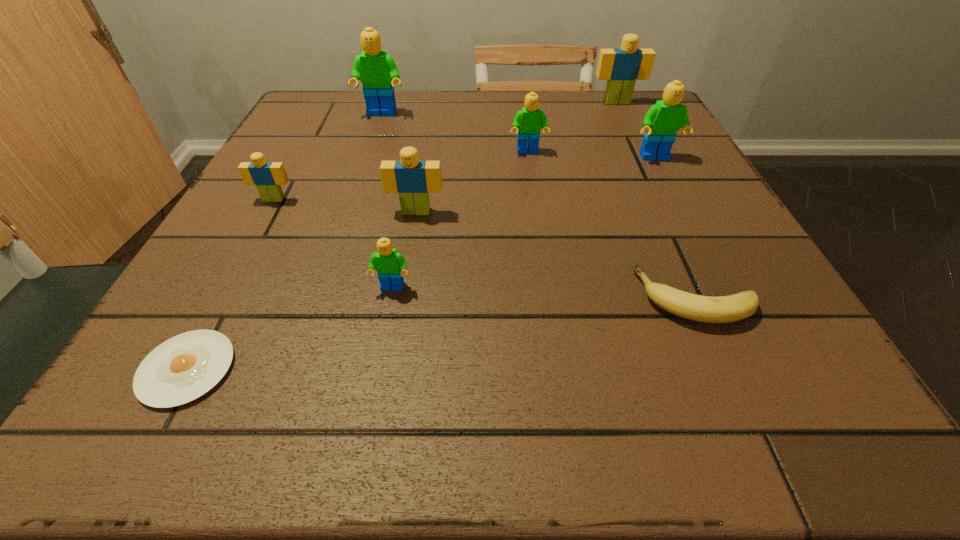
Where is `blank area located on the face of the nearest beige Lego`? blank area located on the face of the nearest beige Lego is located at coordinates (409, 257).

Where is `free region located on the face of the fifth Lego from left to right`? free region located on the face of the fifth Lego from left to right is located at coordinates (534, 191).

The image size is (960, 540). In order to click on free point located on the face of the smallest beige Lego in this screenshot , I will do `click(232, 275)`.

Image resolution: width=960 pixels, height=540 pixels. I want to click on vacant space located 0.110m on the face of the nearest Lego, so click(378, 360).

Find the location of a particular element. free region located 0.140m on the back of the yellow banana is located at coordinates (658, 212).

What are the coordinates of `free spot located on the right of the shortest object` in the screenshot? It's located at (313, 369).

Find the location of a particular element. This screenshot has width=960, height=540. object that is positioned at the near edge is located at coordinates (183, 368).

Find the location of a particular element. The width and height of the screenshot is (960, 540). egg yolk that is positioned at the left edge is located at coordinates (183, 368).

You are a GUI agent. You are given a task and a screenshot of the screen. Output one action in this format:
    pyautogui.click(x=<x>, y=<y>)
    Task: Click on the banana located in the right edge section of the desktop
    The height and width of the screenshot is (540, 960).
    Given the screenshot: What is the action you would take?
    pyautogui.click(x=724, y=309)

Where is `object that is at the far left corner`? This screenshot has width=960, height=540. object that is at the far left corner is located at coordinates (377, 71).